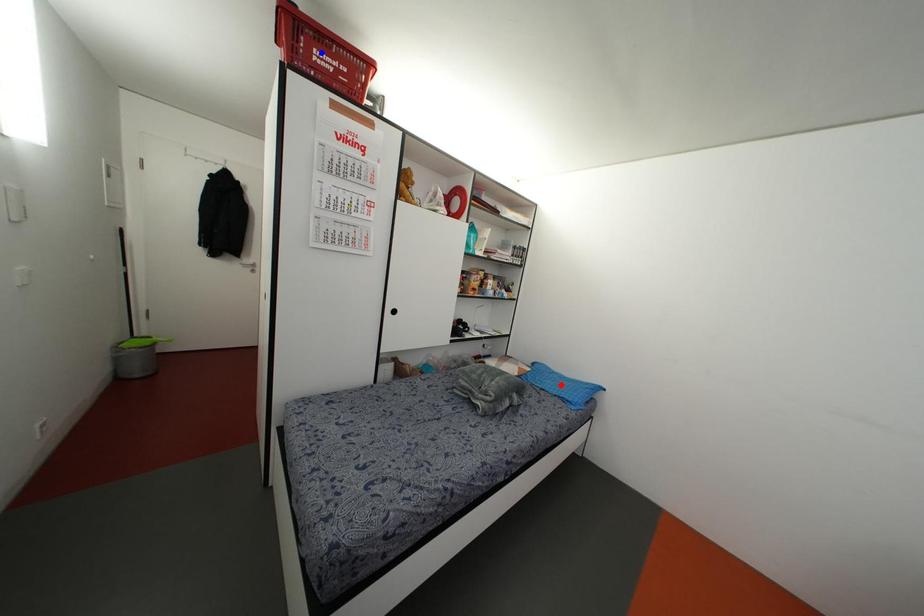
Question: In the image, two points are highlighted. Which point is nearer to the camera? Reply with the corresponding letter.

Choices:
 (A) blue point
 (B) red point

Answer: (A)